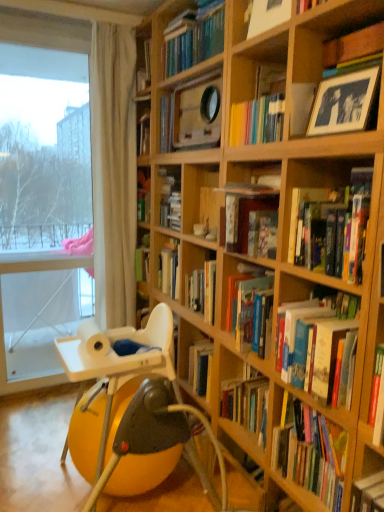
Locate an element on the screen. This screenshot has height=512, width=384. free point above white sheer curtain at left (from a real-world perspective) is located at coordinates (114, 6).